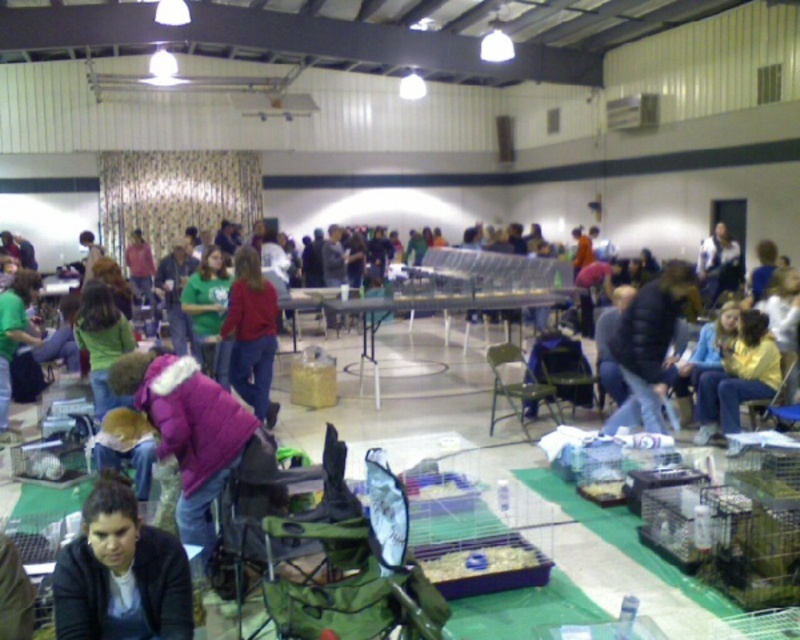
Question: Among these objects, which one is farthest from the camera?

Choices:
 (A) yellow jacket at lower right
 (B) matte red shirt at center
 (C) purple fuzzy coat at center

Answer: (B)

Question: Can you confirm if black puffy jacket at center is thinner than white plastic table at center?

Choices:
 (A) yes
 (B) no

Answer: (A)

Question: Which of these objects is positioned closest to the dark brown hair at lower left?

Choices:
 (A) matte green shirt at left
 (B) matte red shirt at center
 (C) black puffy jacket at center

Answer: (B)

Question: Estimate the real-world distances between objects in this image. Which object is farther from the white plastic table at center?

Choices:
 (A) black puffy jacket at center
 (B) yellow jacket at lower right
 (C) purple fuzzy coat at center
 (D) dark brown hair at lower left

Answer: (D)

Question: Can you confirm if dark brown hair at lower left is positioned to the right of white plastic table at center?

Choices:
 (A) no
 (B) yes

Answer: (A)

Question: Is black puffy jacket at center above matte green shirt at left?

Choices:
 (A) no
 (B) yes

Answer: (A)